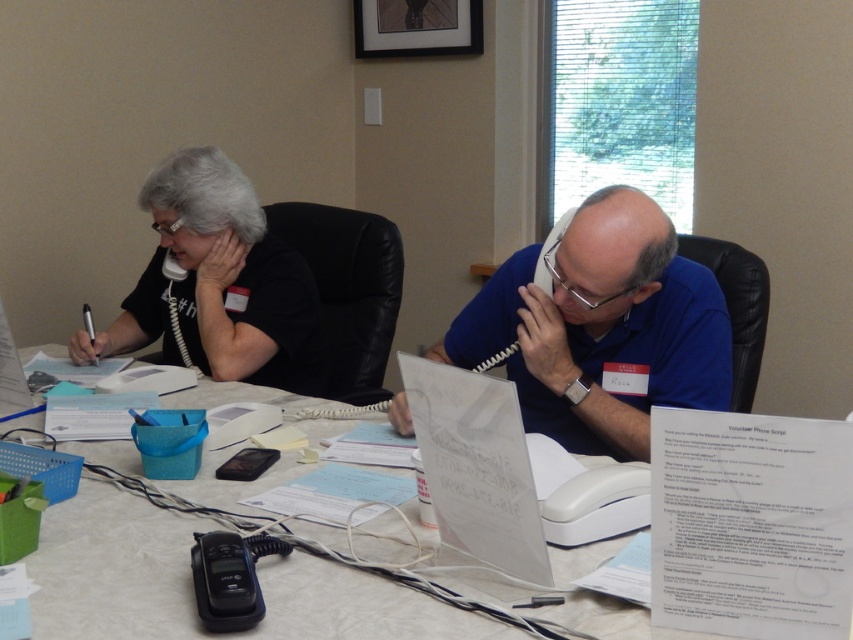
You are a delivery robot with a package that needs to be placed between the blue fabric shirt at center and the black matte shirt at upper left. The package is 30 inches long. Will it fit in the space between them?

The distance between the blue fabric shirt at center and the black matte shirt at upper left is 29.84 inches. Since the package is 30 inches long, it will not fit in the space between them as the available space is slightly smaller than the package.

You are planning to take a photo of the blue fabric shirt at center and the black matte shirt at upper left. Which one should you focus on first if you want to capture both in a single shot without moving the camera?

You should focus on the black matte shirt at upper left first because it is located above the blue fabric shirt at center, so adjusting focus to the upper area will help capture both shirts in the frame.